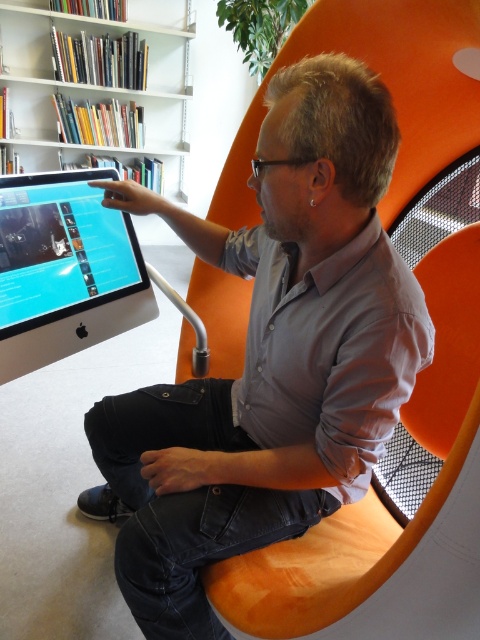
You are a tailor who needs to determine if the gray matte shirt at center can fit into a storage box designed for items narrower than the matte black monitor at left. Based on the scene, can the shirt fit into the box?

The gray matte shirt at center has a larger width than the matte black monitor at left, so it cannot fit into the storage box designed for items narrower than the monitor.

You are an office worker needing to adjust your monitor height. You see the orange wood swivel chair at center and the matte black monitor at left. Which object is positioned lower in the image?

The orange wood swivel chair at center is located below the matte black monitor at left, so the chair is positioned lower.